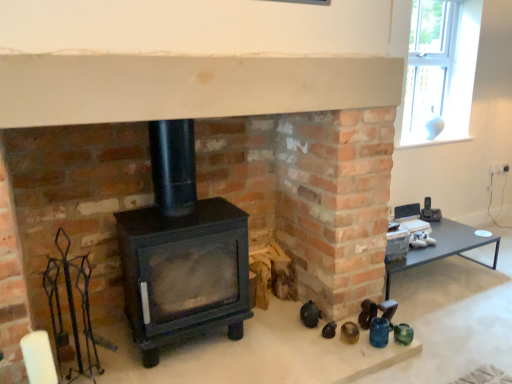
Image resolution: width=512 pixels, height=384 pixels. In order to click on vacant area located to the right-hand side of black matte wood burning stove at center in this screenshot , I will do `click(278, 346)`.